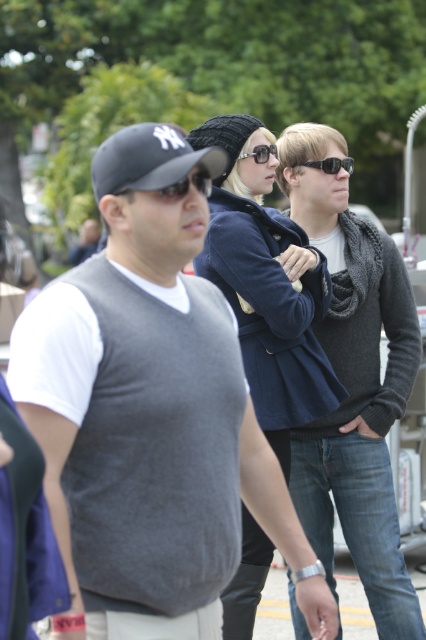
Is dark gray matte baseball cap at center shorter than shiny silver sunglasses at center?

No, dark gray matte baseball cap at center is not shorter than shiny silver sunglasses at center.

Based on the photo, can you confirm if dark gray matte baseball cap at center is positioned above shiny silver sunglasses at center?

Actually, dark gray matte baseball cap at center is below shiny silver sunglasses at center.

Measure the distance between dark gray matte baseball cap at center and camera.

3.26 meters

Find the location of a particular element. dark gray matte baseball cap at center is located at coordinates (149, 160).

Between dark gray matte baseball cap at center and sunglasses at center, which one has more height?

With more height is dark gray matte baseball cap at center.

Is point (209, 163) positioned behind point (204, 188)?

Yes.

Where is `dark gray matte baseball cap at center`? The height and width of the screenshot is (640, 426). dark gray matte baseball cap at center is located at coordinates (149, 160).

Is point (356, 257) positioned after point (238, 160)?

That is True.

Is dark blue knit sweater at center to the left of shiny silver sunglasses at center from the viewer's perspective?

In fact, dark blue knit sweater at center is to the right of shiny silver sunglasses at center.

Who is more forward, (331, 179) or (261, 147)?

Point (261, 147) is in front.

The height and width of the screenshot is (640, 426). Identify the location of dark blue knit sweater at center. (354, 381).